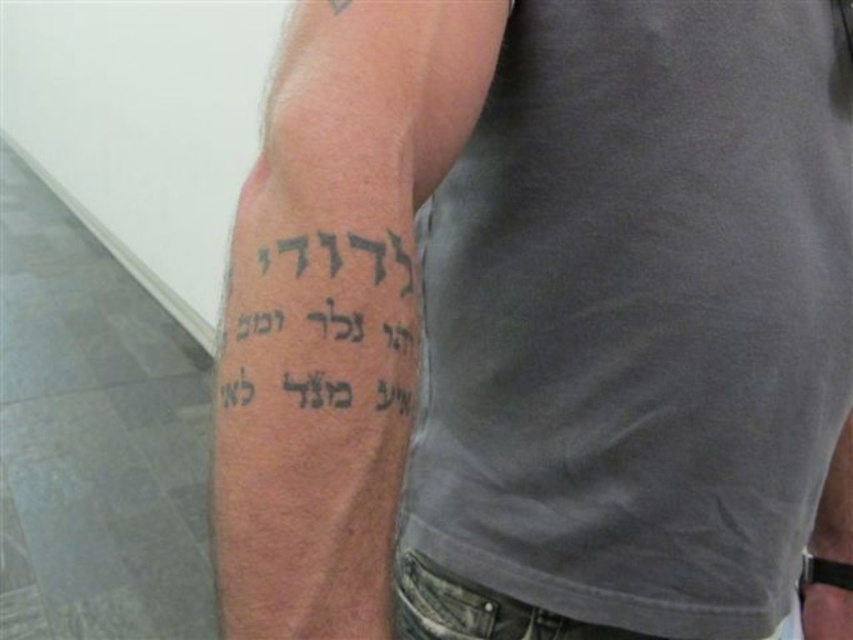
Question: Which object is positioned farthest from the black ink text at upper arm?

Choices:
 (A) black ink tattoo at upper left
 (B) black ink tattoo at lower left

Answer: (B)

Question: Is black ink tattoo at upper left further to the viewer compared to black ink text at upper arm?

Choices:
 (A) no
 (B) yes

Answer: (B)

Question: Which object is the closest to the black ink text at upper arm?

Choices:
 (A) black ink tattoo at lower left
 (B) black ink tattoo at upper left

Answer: (B)

Question: Is black ink tattoo at upper left above black ink text at upper arm?

Choices:
 (A) no
 (B) yes

Answer: (B)

Question: Is black ink tattoo at upper left positioned before black ink text at upper arm?

Choices:
 (A) no
 (B) yes

Answer: (A)

Question: Which object is positioned farthest from the black ink text at upper arm?

Choices:
 (A) black ink tattoo at upper left
 (B) black ink tattoo at lower left

Answer: (B)